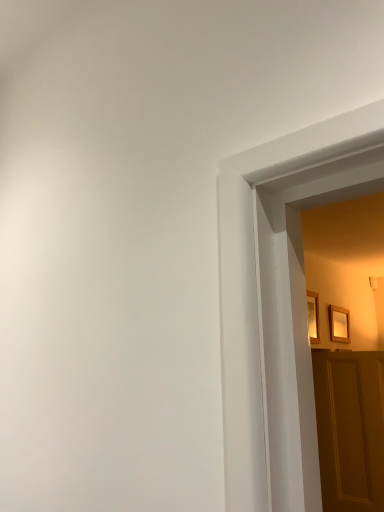
Question: Could wooden picture frame at upper right, the 1th picture frame in the right-to-left sequence, be considered to be inside wooden picture frame at upper right, acting as the 1th picture frame starting from the left?

Choices:
 (A) yes
 (B) no

Answer: (B)

Question: Is wooden picture frame at upper right, acting as the 1th picture frame starting from the left, facing away from wooden picture frame at upper right, marked as the first picture frame in a back-to-front arrangement?

Choices:
 (A) no
 (B) yes

Answer: (A)

Question: Can you confirm if wooden picture frame at upper right, the second picture frame from the right, is taller than wooden picture frame at upper right, marked as the first picture frame in a back-to-front arrangement?

Choices:
 (A) no
 (B) yes

Answer: (B)

Question: Does wooden picture frame at upper right, the second picture frame from the right, appear on the left side of wooden picture frame at upper right, marked as the first picture frame in a back-to-front arrangement?

Choices:
 (A) no
 (B) yes

Answer: (B)

Question: Is wooden picture frame at upper right, the first picture frame from the front, facing towards wooden picture frame at upper right, marked as the first picture frame in a back-to-front arrangement?

Choices:
 (A) yes
 (B) no

Answer: (B)

Question: Considering the positions of wooden picture frame at upper right, the 2th picture frame in the back-to-front sequence, and wooden picture frame at upper right, marked as the first picture frame in a back-to-front arrangement, in the image, is wooden picture frame at upper right, the 2th picture frame in the back-to-front sequence, wider or thinner than wooden picture frame at upper right, marked as the first picture frame in a back-to-front arrangement,?

Choices:
 (A) wide
 (B) thin

Answer: (A)

Question: Do you think wooden picture frame at upper right, the first picture frame from the front, is within wooden picture frame at upper right, which ranks as the second picture frame in left-to-right order, or outside of it?

Choices:
 (A) inside
 (B) outside

Answer: (B)

Question: In terms of height, does wooden picture frame at upper right, the 2th picture frame in the back-to-front sequence, look taller or shorter compared to wooden picture frame at upper right, marked as the first picture frame in a back-to-front arrangement?

Choices:
 (A) short
 (B) tall

Answer: (B)

Question: From the image's perspective, is wooden picture frame at upper right, acting as the 1th picture frame starting from the left, located above or below wooden picture frame at upper right, which ranks as the second picture frame in left-to-right order?

Choices:
 (A) above
 (B) below

Answer: (A)

Question: From the image's perspective, relative to wooden panelled door at right, is wooden picture frame at upper right, the 2th picture frame in the back-to-front sequence, above or below?

Choices:
 (A) above
 (B) below

Answer: (A)

Question: Visually, is wooden picture frame at upper right, the first picture frame from the front, positioned to the left or to the right of wooden panelled door at right?

Choices:
 (A) left
 (B) right

Answer: (A)

Question: Is wooden picture frame at upper right, acting as the 1th picture frame starting from the left, wider or thinner than wooden panelled door at right?

Choices:
 (A) thin
 (B) wide

Answer: (A)

Question: In terms of size, does wooden picture frame at upper right, the first picture frame from the front, appear bigger or smaller than wooden panelled door at right?

Choices:
 (A) big
 (B) small

Answer: (B)

Question: From the image's perspective, relative to wooden picture frame at upper right, the second picture frame from the right, is wooden picture frame at upper right, which ranks as the second picture frame in left-to-right order, above or below?

Choices:
 (A) above
 (B) below

Answer: (B)

Question: Is wooden picture frame at upper right, the 1th picture frame in the right-to-left sequence, wider or thinner than wooden picture frame at upper right, the 2th picture frame in the back-to-front sequence?

Choices:
 (A) thin
 (B) wide

Answer: (A)